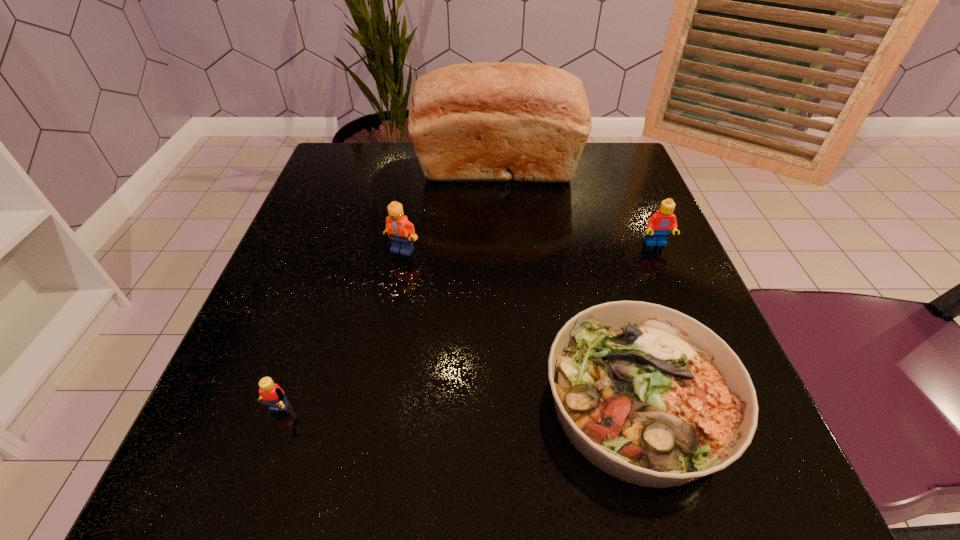
The height and width of the screenshot is (540, 960). What are the coordinates of `empty space that is in between the second Lego from right to left and the rightmost Lego` in the screenshot? It's located at (529, 247).

I want to click on empty space between the rightmost Lego and the farthest object, so click(x=577, y=207).

Locate an element on the screen. The image size is (960, 540). free space between the tallest object and the leftmost object is located at coordinates (387, 295).

Image resolution: width=960 pixels, height=540 pixels. Find the location of `vacant space that is in between the leftmost object and the second Lego from right to left`. vacant space that is in between the leftmost object and the second Lego from right to left is located at coordinates (340, 334).

The image size is (960, 540). Identify the location of free space between the rightmost Lego and the second Lego from left to right. (529, 247).

Image resolution: width=960 pixels, height=540 pixels. I want to click on empty space that is in between the leftmost Lego and the rightmost Lego, so click(x=466, y=331).

Find the location of a particular element. The width and height of the screenshot is (960, 540). empty space that is in between the rightmost Lego and the leftmost Lego is located at coordinates (466, 331).

Where is `free spot between the rightmost Lego and the nearest Lego`? The image size is (960, 540). free spot between the rightmost Lego and the nearest Lego is located at coordinates (466, 331).

Locate which object ranks second in proximity to the rightmost Lego. Please provide its 2D coordinates. Your answer should be formatted as a tuple, i.e. [(x, y)], where the tuple contains the x and y coordinates of a point satisfying the conditions above.

[(649, 395)]

Find the location of a particular element. The height and width of the screenshot is (540, 960). the closest object to the leftmost Lego is located at coordinates (401, 231).